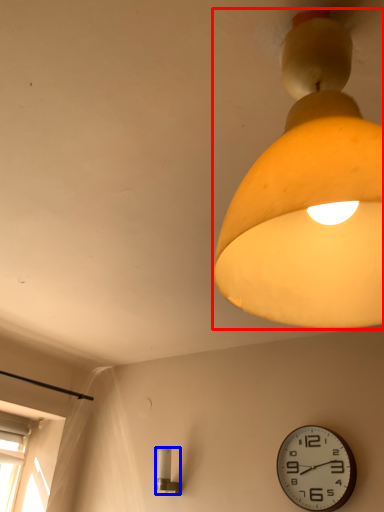
Question: Which object is closer to the camera taking this photo, lamp (highlighted by a red box) or lamp (highlighted by a blue box)?

Choices:
 (A) lamp
 (B) lamp

Answer: (A)